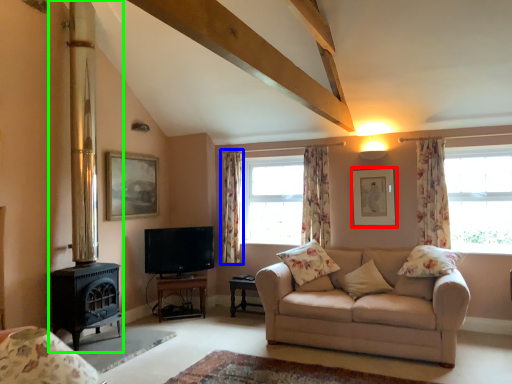
Question: Which object is positioned closest to picture frame (highlighted by a red box)? Select from curtain (highlighted by a blue box) and fireplace (highlighted by a green box).

Choices:
 (A) curtain
 (B) fireplace

Answer: (A)